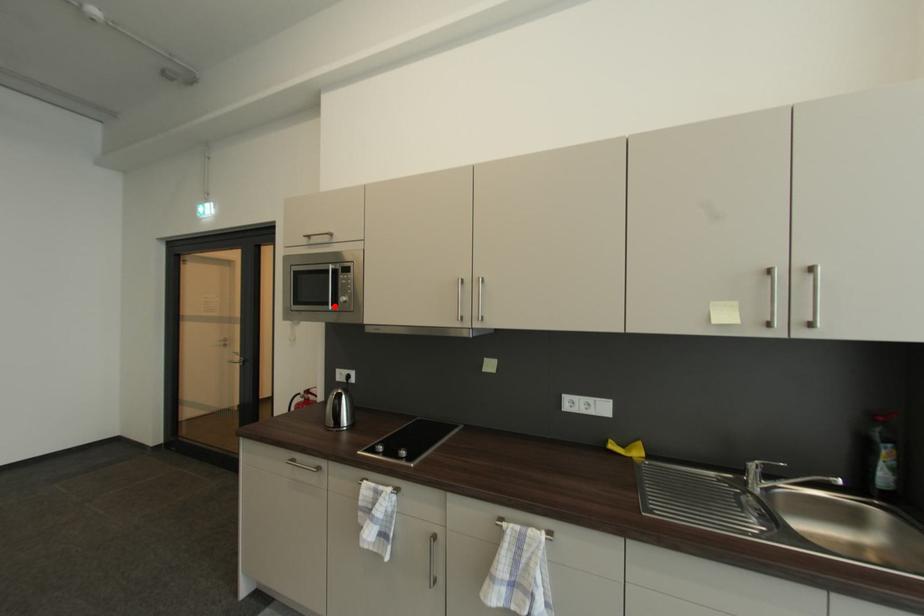
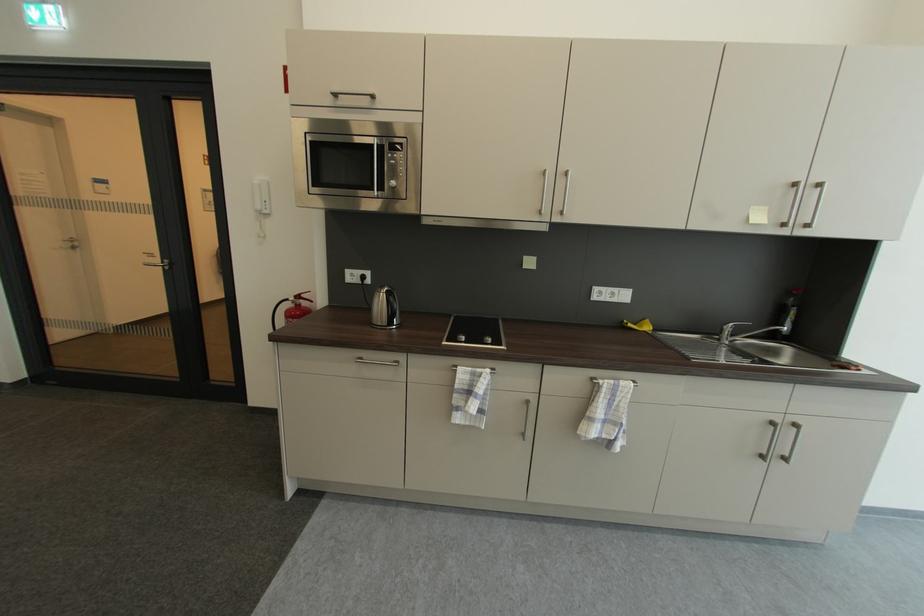
Find the pixel in the second image that matches the highlighted location in the first image.

(380, 191)